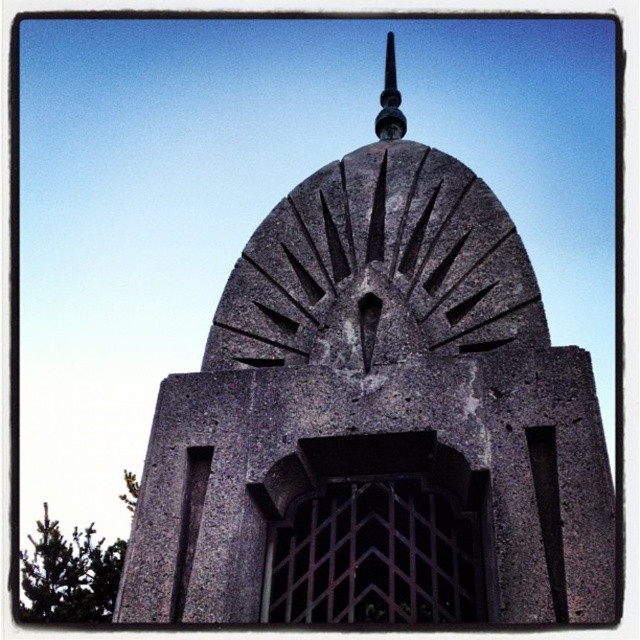
You are an architect analyzing the stone structure. You notice the gray stone tower at center and the polished metal spire at upper center. Which of these two objects has a greater width?

The gray stone tower at center has a greater width than the polished metal spire at upper center.

You are standing in front of the gray stone tower at center and the polished metal spire at upper center. Which object is positioned to the right side?

The polished metal spire at upper center is positioned to the right of the gray stone tower at center.

You are an architect examining the stone structure. You notice the gray stone tower at center and the polished metal spire at upper center. Which object is positioned higher in the structure?

The polished metal spire at upper center is positioned higher than the gray stone tower at center, as it is located above it.